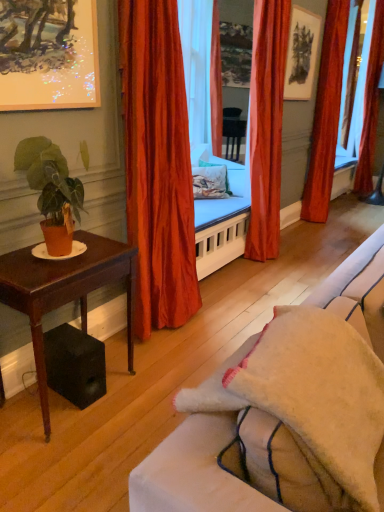
Where is `vacant region in front of matte orange pot at left`? vacant region in front of matte orange pot at left is located at coordinates (37, 272).